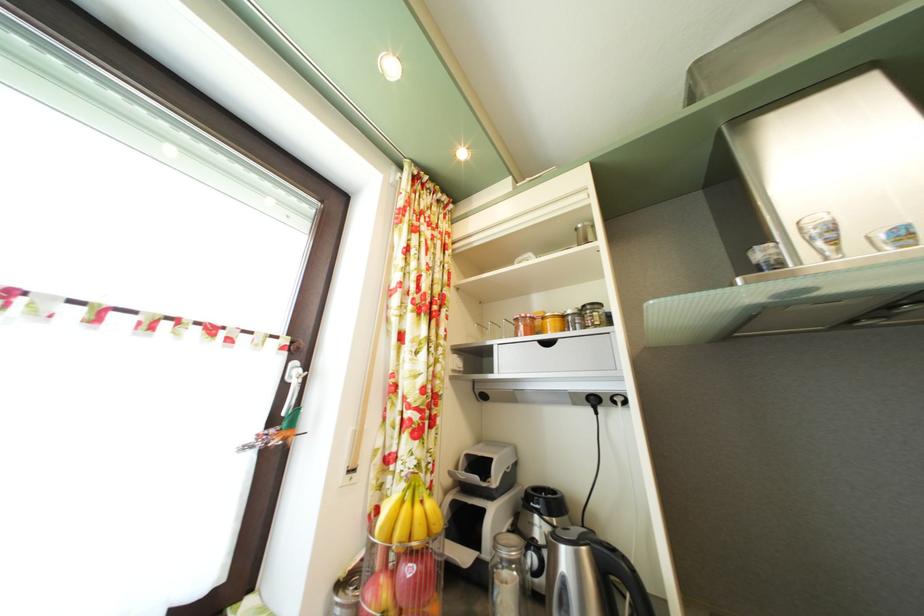
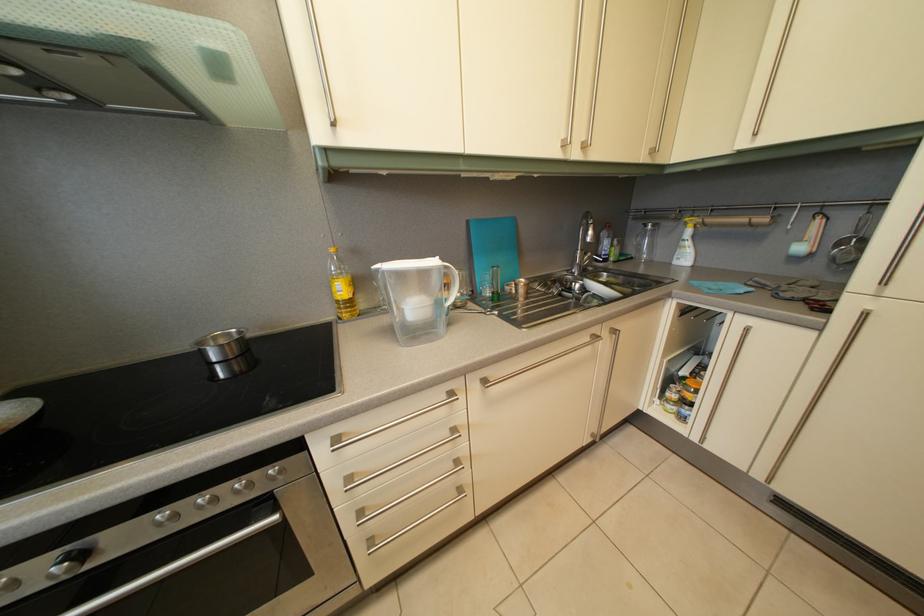
How did the camera likely rotate?

The camera's rotation is toward right-down.